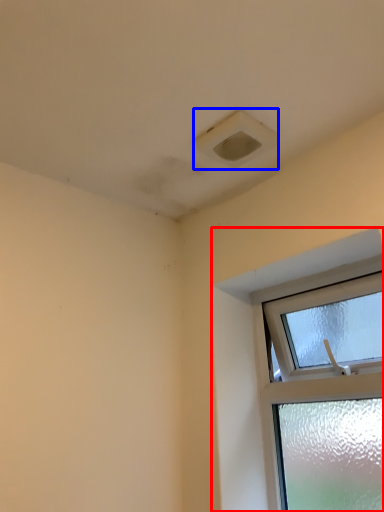
Question: Which object appears closest to the camera in this image, window (highlighted by a red box) or air conditioning (highlighted by a blue box)?

Choices:
 (A) window
 (B) air conditioning

Answer: (A)